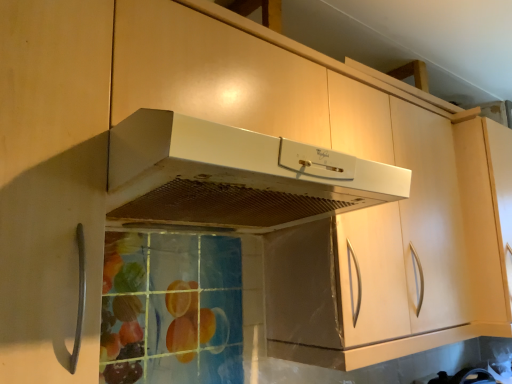
What is the approximate width of white matte range hood at center?

It is 20.77 inches.

What do you see at coordinates (234, 176) in the screenshot?
I see `white matte range hood at center` at bounding box center [234, 176].

In order to click on white matte range hood at center in this screenshot , I will do `click(234, 176)`.

The image size is (512, 384). What do you see at coordinates (430, 219) in the screenshot?
I see `matte wood cabinet at upper right` at bounding box center [430, 219].

At what (x,y) coordinates should I click in order to perform the action: click on matte wood cabinet at upper right. Please return your answer as a coordinate pair (x, y). Looking at the image, I should click on (430, 219).

The height and width of the screenshot is (384, 512). Identify the location of white matte range hood at center. [x=234, y=176].

Considering the relative positions of matte wood cabinet at upper right and white matte range hood at center in the image provided, is matte wood cabinet at upper right to the right of white matte range hood at center from the viewer's perspective?

Yes, matte wood cabinet at upper right is to the right of white matte range hood at center.

In the image, is matte wood cabinet at upper right positioned in front of or behind white matte range hood at center?

matte wood cabinet at upper right is positioned farther from the viewer than white matte range hood at center.

Which point is more distant from viewer, (417, 122) or (167, 218)?

The point (417, 122) is behind.

From the image's perspective, is matte wood cabinet at upper right beneath white matte range hood at center?

Yes.

From a real-world perspective, who is located higher, matte wood cabinet at upper right or white matte range hood at center?

white matte range hood at center.

Considering the sizes of matte wood cabinet at upper right and white matte range hood at center in the image, is matte wood cabinet at upper right wider or thinner than white matte range hood at center?

Considering their sizes, matte wood cabinet at upper right looks slimmer than white matte range hood at center.

Is matte wood cabinet at upper right taller than white matte range hood at center?

Indeed, matte wood cabinet at upper right has a greater height compared to white matte range hood at center.

Is matte wood cabinet at upper right bigger or smaller than white matte range hood at center?

Clearly, matte wood cabinet at upper right is larger in size than white matte range hood at center.

Which is correct: matte wood cabinet at upper right is inside white matte range hood at center, or outside of it?

matte wood cabinet at upper right cannot be found inside white matte range hood at center.

Is matte wood cabinet at upper right far away from white matte range hood at center?

They are positioned close to each other.

Looking at this image, is matte wood cabinet at upper right facing away from white matte range hood at center?

No, matte wood cabinet at upper right is not facing the opposite direction of white matte range hood at center.

Can you tell me how much matte wood cabinet at upper right and white matte range hood at center differ in facing direction?

There is a 7.49e-06-degree angle between the facing directions of matte wood cabinet at upper right and white matte range hood at center.

Locate an element on the screen. The image size is (512, 384). cabinetry behind the white matte range hood at center is located at coordinates (430, 219).

Between white matte range hood at center and matte wood cabinet at upper right, which one appears on the right side from the viewer's perspective?

Positioned to the right is matte wood cabinet at upper right.

Does white matte range hood at center lie in front of matte wood cabinet at upper right?

Yes, white matte range hood at center is closer to the camera.

Considering the positions of point (196, 214) and point (428, 249), is point (196, 214) closer or farther from the camera than point (428, 249)?

Clearly, point (196, 214) is closer to the camera than point (428, 249).

From the image's perspective, would you say white matte range hood at center is shown under matte wood cabinet at upper right?

Incorrect, from the image's perspective, white matte range hood at center is higher than matte wood cabinet at upper right.

From a real-world perspective, who is located higher, white matte range hood at center or matte wood cabinet at upper right?

From a 3D spatial view, white matte range hood at center is above.

Based on the photo, does white matte range hood at center have a lesser width compared to matte wood cabinet at upper right?

Incorrect, the width of white matte range hood at center is not less than that of matte wood cabinet at upper right.

Is white matte range hood at center taller or shorter than matte wood cabinet at upper right?

white matte range hood at center is shorter than matte wood cabinet at upper right.

Considering the relative sizes of white matte range hood at center and matte wood cabinet at upper right in the image provided, is white matte range hood at center smaller than matte wood cabinet at upper right?

Yes.

In the scene shown: Is white matte range hood at center located outside matte wood cabinet at upper right?

Yes.

Are white matte range hood at center and matte wood cabinet at upper right making contact?

No, white matte range hood at center is not beside matte wood cabinet at upper right.

Could you tell me if white matte range hood at center is turned towards matte wood cabinet at upper right?

No, white matte range hood at center is not facing towards matte wood cabinet at upper right.

Find the location of a particular element. cabinetry on the right of the white matte range hood at center is located at coordinates (430, 219).

Image resolution: width=512 pixels, height=384 pixels. I want to click on home appliance located in front of the matte wood cabinet at upper right, so click(x=234, y=176).

The height and width of the screenshot is (384, 512). What are the coordinates of `cabinetry below the white matte range hood at center (from the image's perspective)` in the screenshot? It's located at (430, 219).